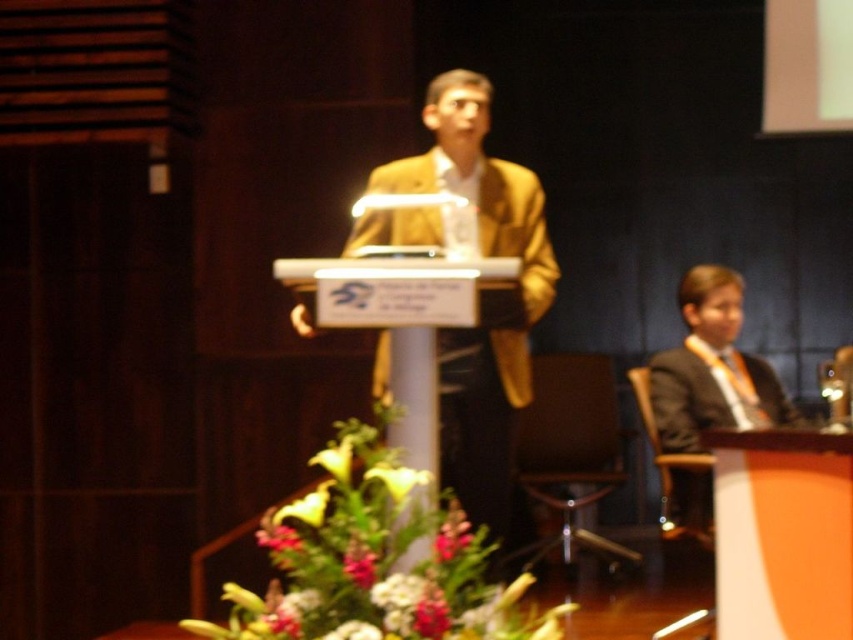
Question: Which of these objects is positioned closest to the green leafy plant at center?

Choices:
 (A) matte black suit at right
 (B) yellow matte flower at center

Answer: (B)

Question: Which of these objects is positioned closest to the yellow matte flower at center?

Choices:
 (A) green leafy plant at center
 (B) matte black suit at right
 (C) white glossy lily at center

Answer: (C)

Question: Can you confirm if green leafy plant at center is smaller than yellow matte flower at center?

Choices:
 (A) yes
 (B) no

Answer: (B)

Question: Which of the following is the farthest from the observer?

Choices:
 (A) green leafy plant at center
 (B) matte gold suit at center
 (C) yellow matte flower at center

Answer: (B)

Question: Does matte black suit at right appear on the left side of yellow matte flower at center?

Choices:
 (A) yes
 (B) no

Answer: (B)

Question: Is matte black suit at right smaller than white glossy lily at center?

Choices:
 (A) no
 (B) yes

Answer: (A)